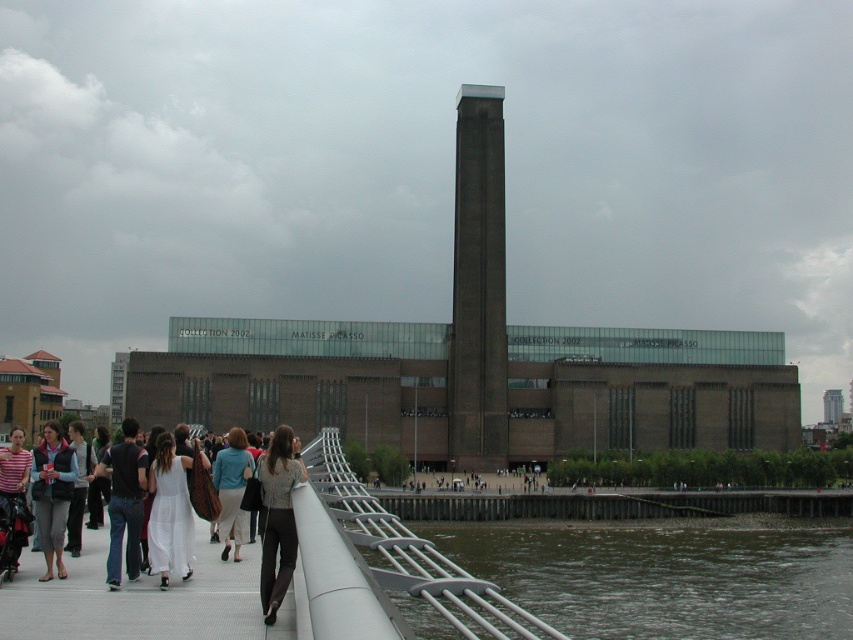
Question: From the image, what is the correct spatial relationship of brown brick tower at center in relation to dark gray pants at center?

Choices:
 (A) below
 (B) above

Answer: (B)

Question: Among these points, which one is nearest to the camera?

Choices:
 (A) (13, 561)
 (B) (67, 470)
 (C) (372, 534)
 (D) (241, 448)

Answer: (C)

Question: Does white fabric dress at center appear on the left side of white cotton dress at lower center?

Choices:
 (A) no
 (B) yes

Answer: (A)

Question: Is the position of white fabric dress at center less distant than that of matte black vest at lower left?

Choices:
 (A) yes
 (B) no

Answer: (A)

Question: Which of the following is the closest to the observer?

Choices:
 (A) (7, 568)
 (B) (206, 563)

Answer: (A)

Question: Estimate the real-world distances between objects in this image. Which object is farther from the dark brown water at lower center?

Choices:
 (A) matte black vest at lower left
 (B) white mesh bridge at lower left
 (C) dark blue jeans at left

Answer: (A)